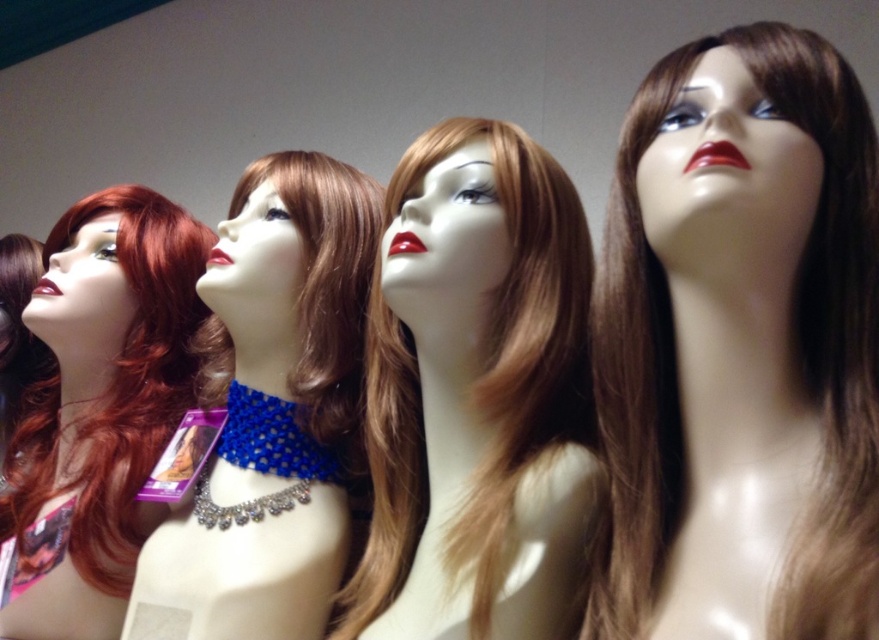
Is shiny brown wig at center to the left of blue beaded necklace at center from the viewer's perspective?

In fact, shiny brown wig at center is to the right of blue beaded necklace at center.

Who is positioned more to the right, shiny brown wig at center or blue beaded necklace at center?

Positioned to the right is shiny brown wig at center.

Who is more forward, (481, 314) or (233, 577)?

Point (481, 314)

I want to click on shiny brown wig at center, so click(477, 396).

Which of these two, brown shiny wig at center or shiny red wig at left, stands taller?

shiny red wig at left

Does brown shiny wig at center have a greater height compared to shiny red wig at left?

In fact, brown shiny wig at center may be shorter than shiny red wig at left.

Between point (707, 227) and point (52, 417), which one is positioned behind?

The point (52, 417) is more distant.

Where is `brown shiny wig at center`? brown shiny wig at center is located at coordinates (739, 348).

Based on the photo, who is lower down, brown shiny wig at center or blue beaded necklace at center?

blue beaded necklace at center is below.

Between point (703, 49) and point (208, 378), which one is positioned behind?

The point (208, 378) is behind.

Find the location of a particular element. brown shiny wig at center is located at coordinates (739, 348).